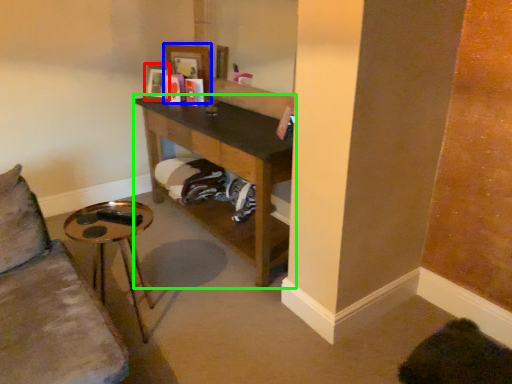
Question: Based on their relative distances, which object is farther from picture frame (highlighted by a red box)? Choose from picture frame (highlighted by a blue box) and shelf (highlighted by a green box).

Choices:
 (A) picture frame
 (B) shelf

Answer: (B)